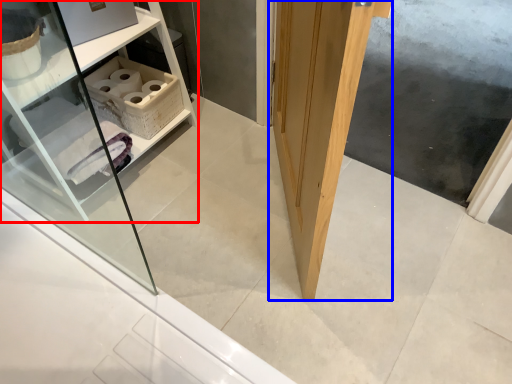
Question: Which object appears closest to the camera in this image, shelf (highlighted by a red box) or door (highlighted by a blue box)?

Choices:
 (A) shelf
 (B) door

Answer: (B)